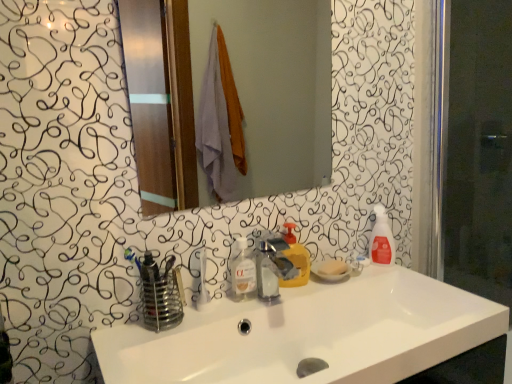
Question: From a real-world perspective, is clear liquid soap at center positioned under metallic silver faucet at center based on gravity?

Choices:
 (A) no
 (B) yes

Answer: (B)

Question: Is metallic silver faucet at center located within clear liquid soap at center?

Choices:
 (A) yes
 (B) no

Answer: (B)

Question: Would you say clear liquid soap at center is a long distance from metallic silver faucet at center?

Choices:
 (A) no
 (B) yes

Answer: (A)

Question: From the image's perspective, is clear liquid soap at center located above metallic silver faucet at center?

Choices:
 (A) yes
 (B) no

Answer: (A)

Question: Is clear liquid soap at center positioned in front of metallic silver faucet at center?

Choices:
 (A) yes
 (B) no

Answer: (B)

Question: Would you say clear liquid soap at center is outside metallic silver faucet at center?

Choices:
 (A) no
 (B) yes

Answer: (B)

Question: Does white glossy mirror at upper center have a smaller size compared to transparent glass screen door at right?

Choices:
 (A) no
 (B) yes

Answer: (B)

Question: Is white glossy mirror at upper center positioned with its back to transparent glass screen door at right?

Choices:
 (A) no
 (B) yes

Answer: (A)

Question: Are white glossy mirror at upper center and transparent glass screen door at right located far from each other?

Choices:
 (A) no
 (B) yes

Answer: (B)

Question: Is white glossy mirror at upper center at the right side of transparent glass screen door at right?

Choices:
 (A) yes
 (B) no

Answer: (B)

Question: Is white glossy mirror at upper center positioned beyond the bounds of transparent glass screen door at right?

Choices:
 (A) no
 (B) yes

Answer: (B)

Question: Are white glossy mirror at upper center and transparent glass screen door at right beside each other?

Choices:
 (A) yes
 (B) no

Answer: (B)

Question: Is the depth of clear liquid soap at center less than that of translucent plastic spray bottle at right, the first cleaning product in the back-to-front sequence?

Choices:
 (A) no
 (B) yes

Answer: (B)